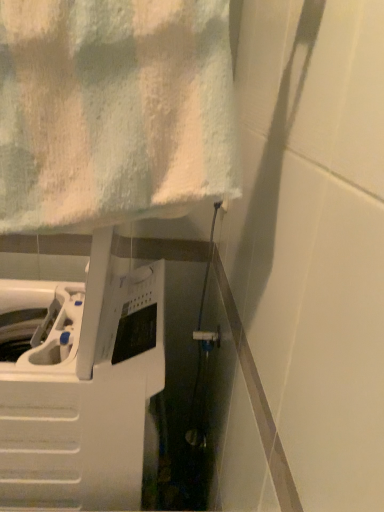
Question: Relative to white textured towel at upper left, is white plastic washing machine at left in front or behind?

Choices:
 (A) front
 (B) behind

Answer: (B)

Question: Would you say white plastic washing machine at left is to the left or to the right of white textured towel at upper left in the picture?

Choices:
 (A) left
 (B) right

Answer: (A)

Question: In terms of height, does white plastic washing machine at left look taller or shorter compared to white textured towel at upper left?

Choices:
 (A) tall
 (B) short

Answer: (A)

Question: In terms of size, does white textured towel at upper left appear bigger or smaller than white plastic washing machine at left?

Choices:
 (A) small
 (B) big

Answer: (A)

Question: Does point (120, 169) appear closer or farther from the camera than point (43, 359)?

Choices:
 (A) closer
 (B) farther

Answer: (A)

Question: In terms of width, does white textured towel at upper left look wider or thinner when compared to white plastic washing machine at left?

Choices:
 (A) thin
 (B) wide

Answer: (A)

Question: Choose the correct answer: Is white textured towel at upper left inside white plastic washing machine at left or outside it?

Choices:
 (A) inside
 (B) outside

Answer: (B)